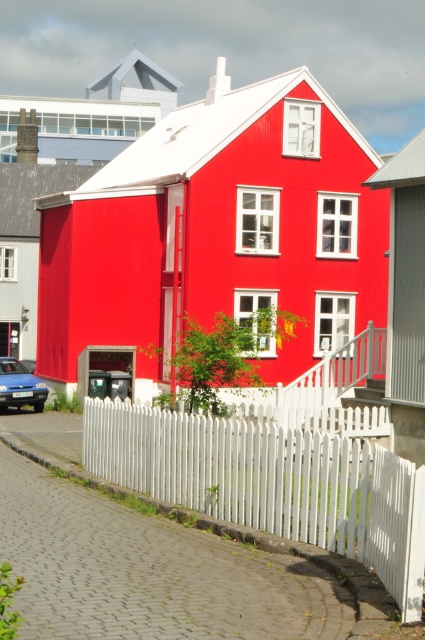
Is white picket fence at lower center positioned at the back of matte blue car at lower left?

No, white picket fence at lower center is in front of matte blue car at lower left.

What are the coordinates of `white picket fence at lower center` in the screenshot? It's located at (272, 483).